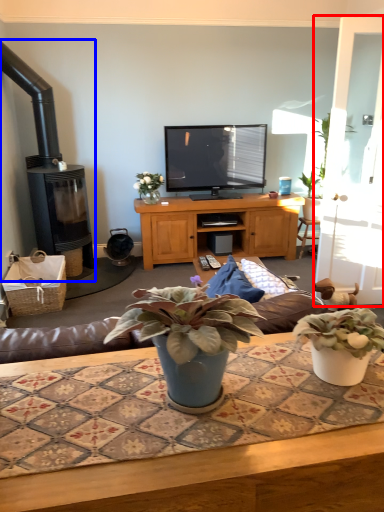
Question: Which of the following is the closest to the observer, glass door (highlighted by a red box) or fireplace (highlighted by a blue box)?

Choices:
 (A) glass door
 (B) fireplace

Answer: (A)